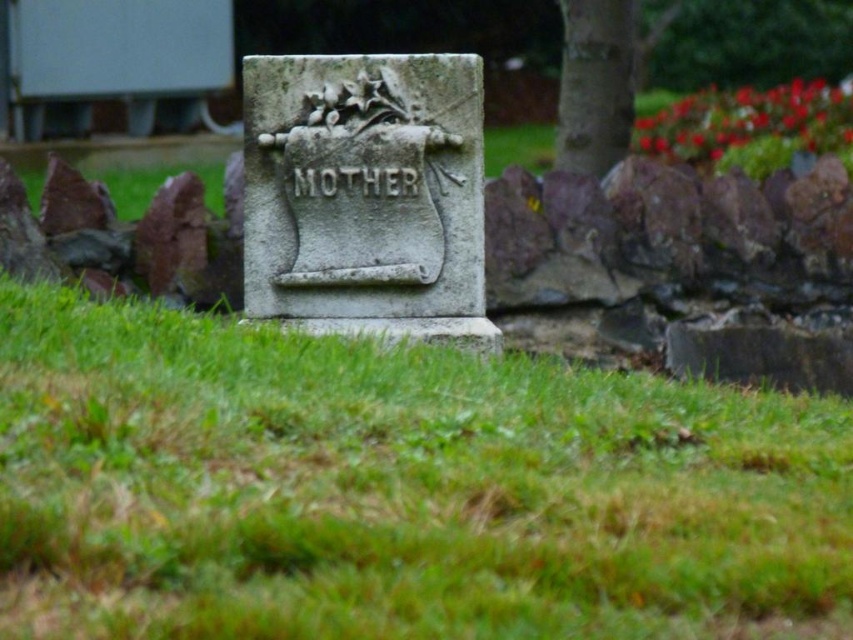
Question: Which point is farther to the camera?

Choices:
 (A) (735, 412)
 (B) (564, 148)
 (C) (418, 289)

Answer: (B)

Question: Which of the following is the closest to the observer?

Choices:
 (A) (563, 48)
 (B) (18, 451)

Answer: (B)

Question: Does gray stone gravestone at center appear on the left side of smooth bark tree at upper right?

Choices:
 (A) no
 (B) yes

Answer: (B)

Question: Does green grass at center have a larger size compared to smooth bark tree at upper right?

Choices:
 (A) yes
 (B) no

Answer: (B)

Question: Estimate the real-world distances between objects in this image. Which object is farther from the smooth bark tree at upper right?

Choices:
 (A) gray stone gravestone at center
 (B) green grass at center

Answer: (B)

Question: Does green grass at center have a lesser width compared to gray stone gravestone at center?

Choices:
 (A) yes
 (B) no

Answer: (A)